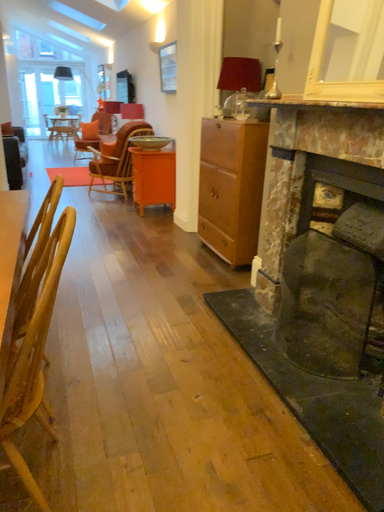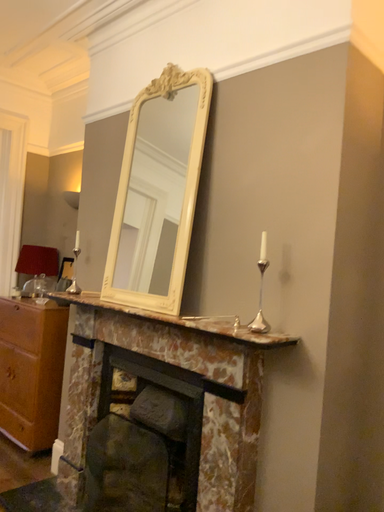
Question: Which way did the camera rotate in the video?

Choices:
 (A) rotated left
 (B) rotated right

Answer: (B)